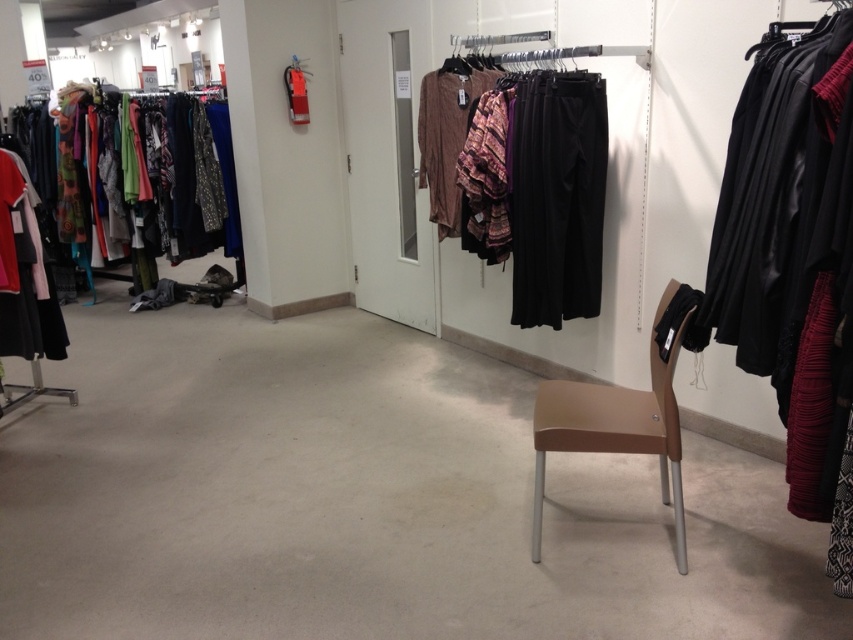
Is matte black clothing rack at left thinner than matte black dress at left?

Incorrect, matte black clothing rack at left's width is not less than matte black dress at left's.

Can you confirm if matte black clothing rack at left is taller than matte black dress at left?

Yes, matte black clothing rack at left is taller than matte black dress at left.

At what (x,y) coordinates should I click in order to perform the action: click on matte black clothing rack at left. Please return your answer as a coordinate pair (x, y). The image size is (853, 640). Looking at the image, I should click on (146, 186).

Is black leather jacket at right positioned in front of matte black clothing rack at left?

Yes, it is in front of matte black clothing rack at left.

Can you confirm if black leather jacket at right is positioned above matte black clothing rack at left?

No.

Describe the element at coordinates (770, 205) in the screenshot. I see `black leather jacket at right` at that location.

Locate an element on the screen. black leather jacket at right is located at coordinates click(770, 205).

Measure the distance between matte black pants at center and camera.

matte black pants at center and camera are 2.84 meters apart.

Is matte black pants at center positioned before matte black dress at left?

Yes, matte black pants at center is in front of matte black dress at left.

Find the location of a particular element. The image size is (853, 640). matte black pants at center is located at coordinates (526, 182).